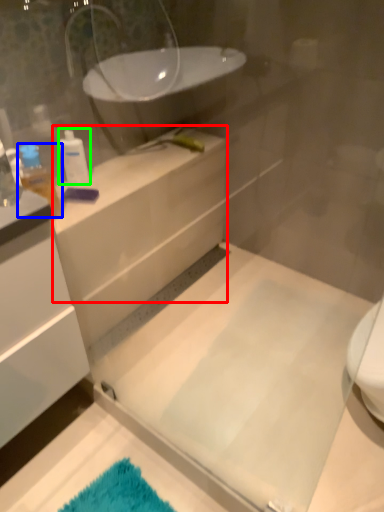
Question: Which is nearer to the counter top (highlighted by a red box)? toiletry (highlighted by a blue box) or toiletry (highlighted by a green box).

Choices:
 (A) toiletry
 (B) toiletry

Answer: (B)